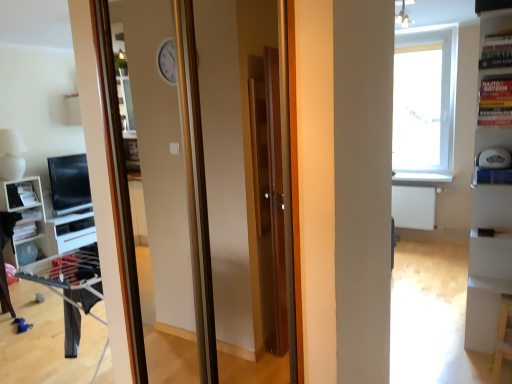
Question: Could you tell me if transparent glass window at upper right is facing matte black monitor at left?

Choices:
 (A) yes
 (B) no

Answer: (B)

Question: From the image's perspective, is transparent glass window at upper right above matte black monitor at left?

Choices:
 (A) yes
 (B) no

Answer: (A)

Question: Is transparent glass window at upper right further to the viewer compared to matte black monitor at left?

Choices:
 (A) yes
 (B) no

Answer: (B)

Question: Is matte black monitor at left located within transparent glass window at upper right?

Choices:
 (A) yes
 (B) no

Answer: (B)

Question: From a real-world perspective, is transparent glass window at upper right located beneath matte black monitor at left?

Choices:
 (A) no
 (B) yes

Answer: (A)

Question: Can you confirm if transparent glass window at upper right is thinner than matte black monitor at left?

Choices:
 (A) yes
 (B) no

Answer: (B)

Question: Is matte black monitor at left completely or partially outside of transparent glass window at upper right?

Choices:
 (A) no
 (B) yes

Answer: (B)

Question: Does matte black monitor at left have a greater height compared to transparent glass window at upper right?

Choices:
 (A) no
 (B) yes

Answer: (A)

Question: Does matte black monitor at left have a greater width compared to transparent glass window at upper right?

Choices:
 (A) yes
 (B) no

Answer: (B)

Question: Is matte black monitor at left positioned behind transparent glass window at upper right?

Choices:
 (A) no
 (B) yes

Answer: (B)

Question: Is matte black monitor at left positioned in front of transparent glass window at upper right?

Choices:
 (A) no
 (B) yes

Answer: (A)

Question: From a real-world perspective, does matte black monitor at left sit lower than transparent glass window at upper right?

Choices:
 (A) yes
 (B) no

Answer: (A)

Question: From the image's perspective, does white glossy shelf at left appear lower than white glossy bookshelf at right?

Choices:
 (A) yes
 (B) no

Answer: (A)